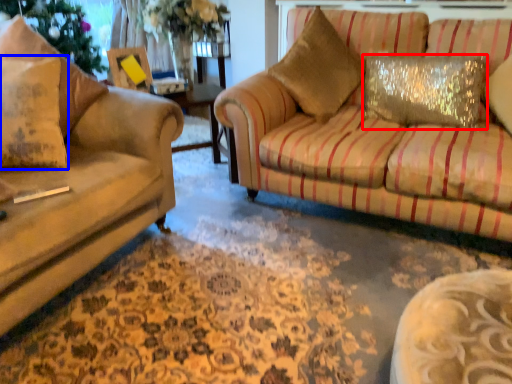
Question: Among these objects, which one is nearest to the camera, pillow (highlighted by a red box) or pillow (highlighted by a blue box)?

Choices:
 (A) pillow
 (B) pillow

Answer: (B)